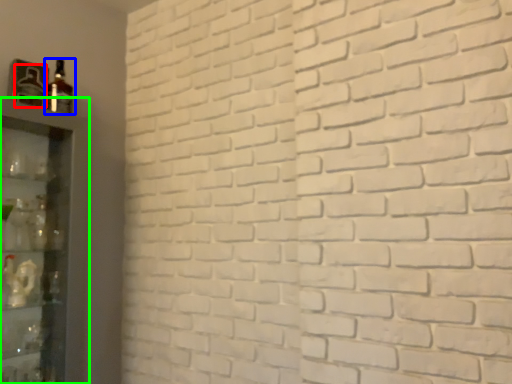
Question: Estimate the real-world distances between objects in this image. Which object is closer to bottle (highlighted by a red box), bottle (highlighted by a blue box) or shelf (highlighted by a green box)?

Choices:
 (A) bottle
 (B) shelf

Answer: (A)